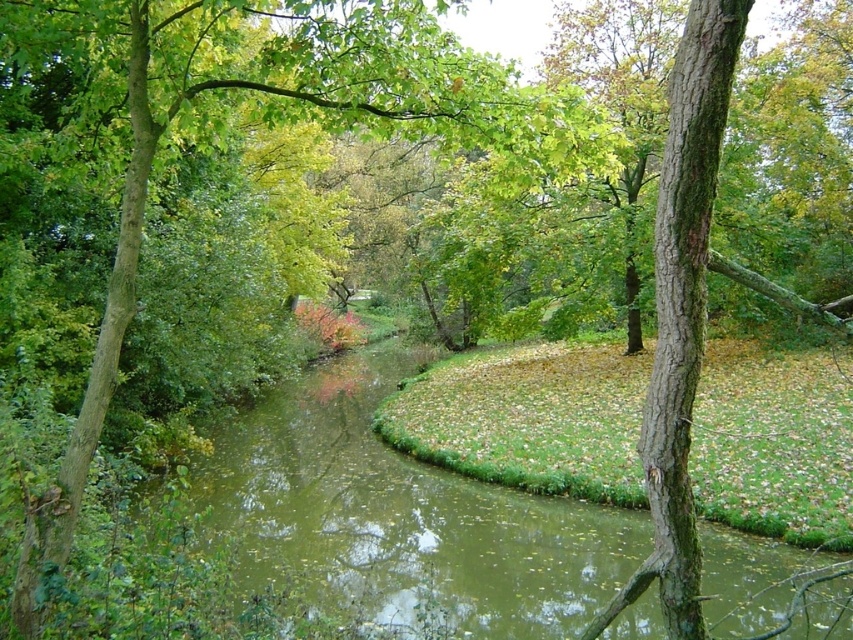
Is green murky water at center bigger than green leafy tree at center?

Indeed, green murky water at center has a larger size compared to green leafy tree at center.

Who is higher up, green murky water at center or green leafy tree at center?

green leafy tree at center is above.

Is point (410, 532) positioned behind point (178, 10)?

Yes, point (410, 532) is behind point (178, 10).

Locate an element on the screen. green murky water at center is located at coordinates (399, 516).